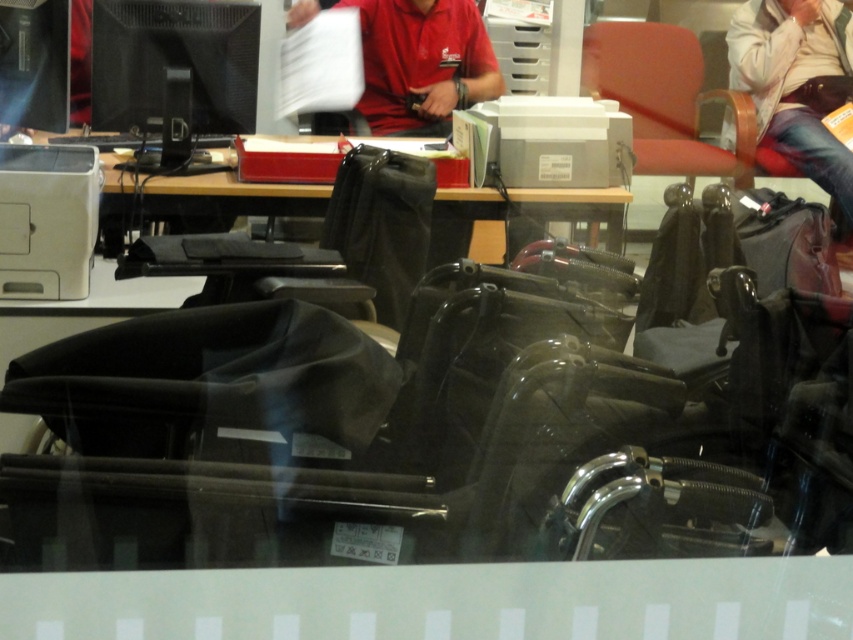
Question: Which point is closer to the camera taking this photo?

Choices:
 (A) (619, 44)
 (B) (209, 294)

Answer: (B)

Question: Which is nearer to the black plastic wheelchair at center?

Choices:
 (A) matte black monitor at upper left
 (B) matte red chair at upper right
 (C) black matte monitor at upper left
 (D) black leather chair at center

Answer: (D)

Question: Which of these objects is positioned closest to the matte black monitor at upper left?

Choices:
 (A) black leather chair at center
 (B) black matte monitor at upper left
 (C) matte red chair at upper right

Answer: (B)

Question: Observing the image, what is the correct spatial positioning of black matte monitor at upper left in reference to matte red chair at upper right?

Choices:
 (A) below
 (B) above

Answer: (A)

Question: Is black matte monitor at upper left thinner than black leather chair at center?

Choices:
 (A) yes
 (B) no

Answer: (B)

Question: Is black plastic wheelchair at center thinner than black leather chair at center?

Choices:
 (A) yes
 (B) no

Answer: (B)